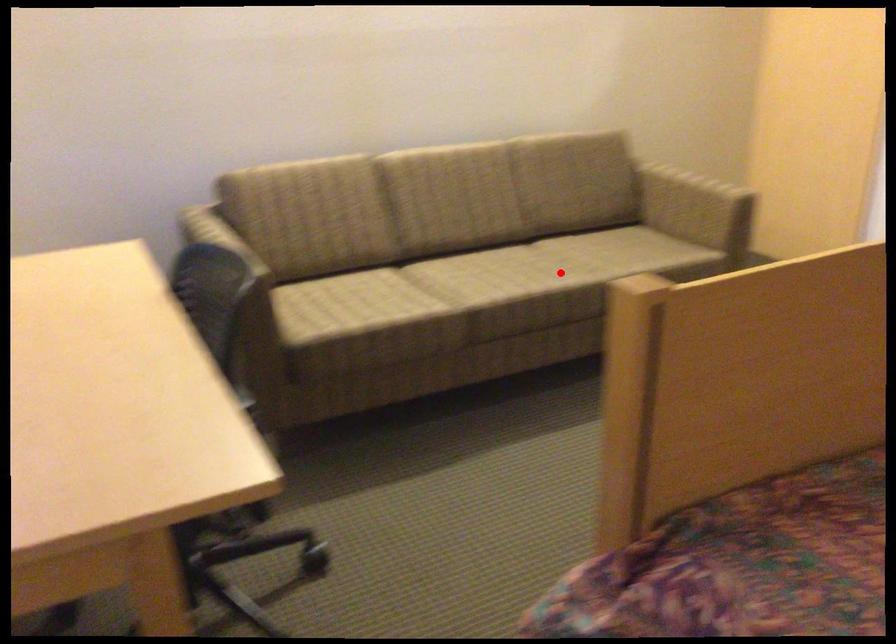
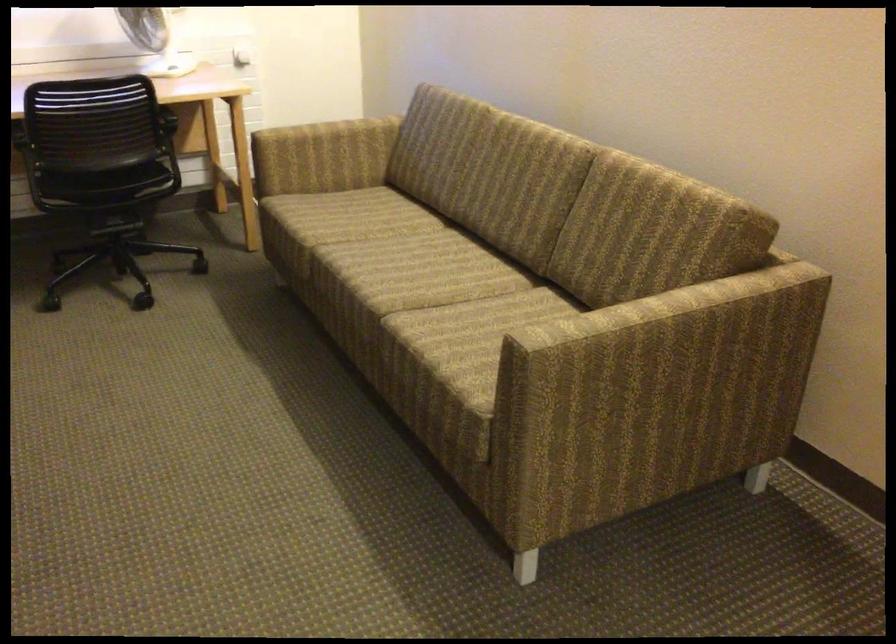
Question: I am providing you with two images of the same scene from different viewpoints. In image1, a red point is highlighted. Considering the same 3D point in image2, which of the following is correct?

Choices:
 (A) It is closer
 (B) It is farther

Answer: (A)